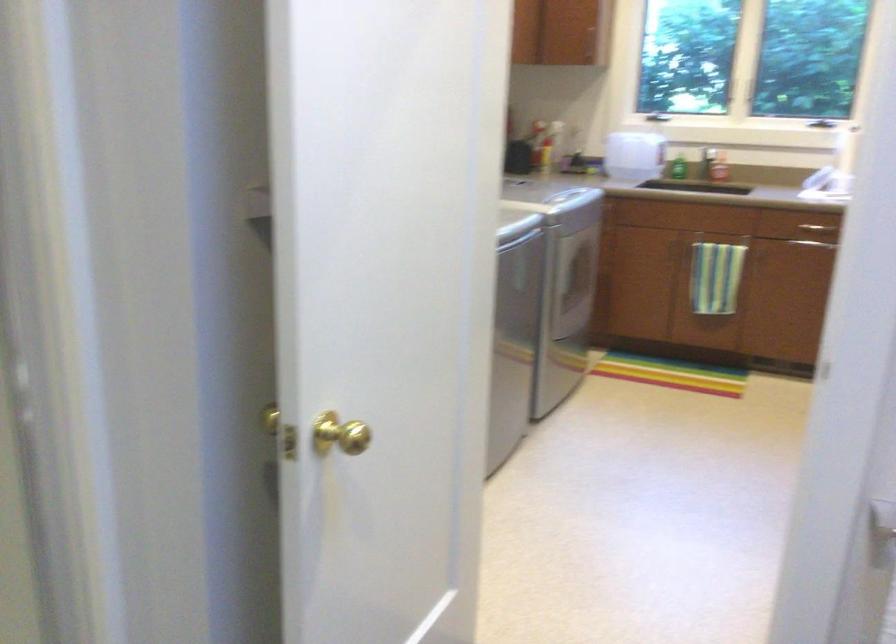
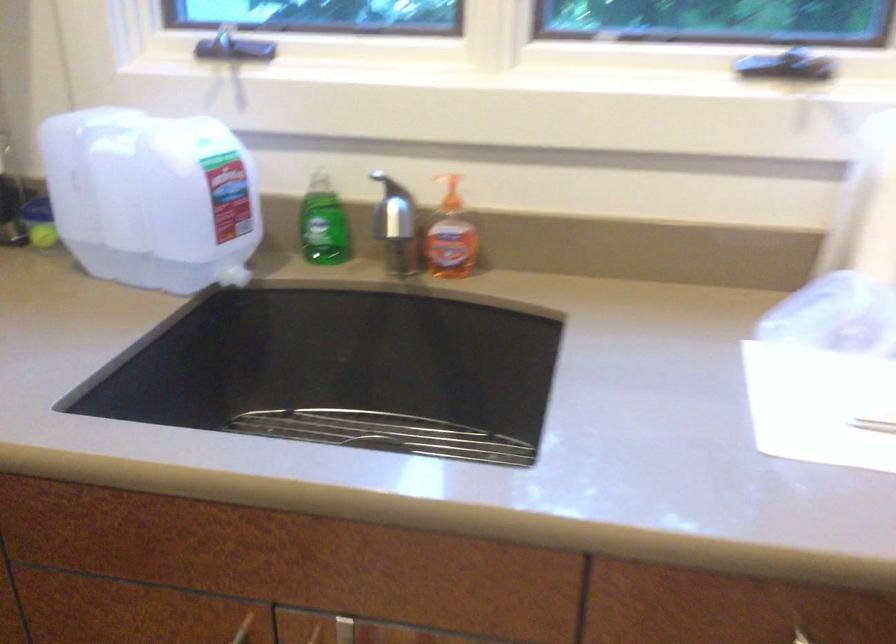
The point at [698,234] is marked in the first image. Where is the corresponding point in the second image?

(343, 630)